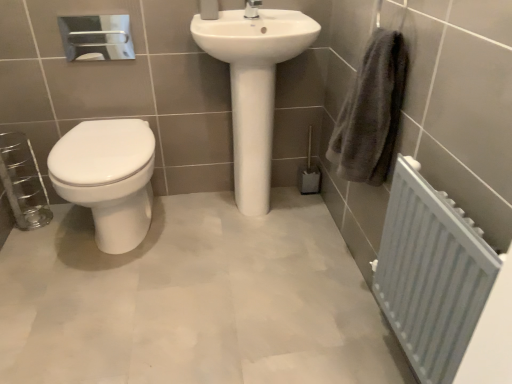
Where is `free space that is in between white glossy toilet at left and white glossy sink at center`? free space that is in between white glossy toilet at left and white glossy sink at center is located at coordinates (209, 233).